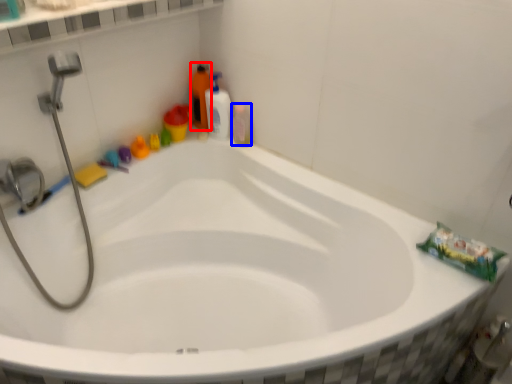
Question: Which object appears farthest to the camera in this image, cleaning product (highlighted by a red box) or mouthwash (highlighted by a blue box)?

Choices:
 (A) cleaning product
 (B) mouthwash

Answer: (A)